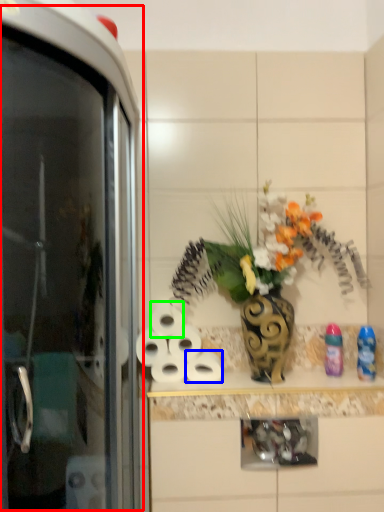
Question: Which object is the closest to the screen door (highlighted by a red box)? Choose among these: toilet paper (highlighted by a blue box) or toilet paper (highlighted by a green box).

Choices:
 (A) toilet paper
 (B) toilet paper

Answer: (B)